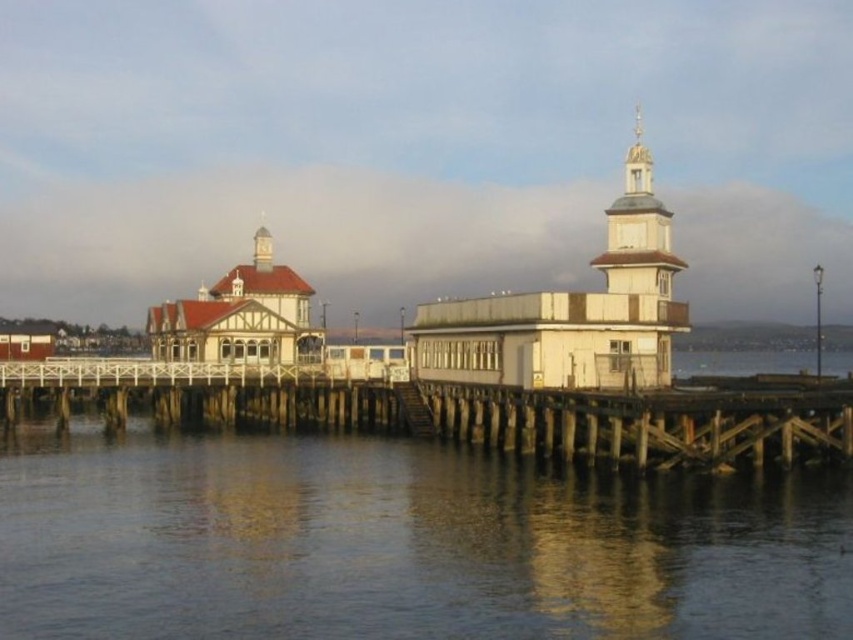
You are standing on the wooden pier and want to take a photo of both the wooden at lower center and the white wooden tower at center. Which one should you point your camera towards first if you want to capture them in the order they appear from left to right?

You should first point your camera towards the wooden at lower center since it is positioned to the left of the white wooden tower at center.

You are a delivery drone that needs to land on the white wooden tower at center. The landing pad is on the tower, and your current position is above the transparent water at lower center. What is the horizontal distance you need to cover to reach the landing pad?

The horizontal distance between the transparent water at lower center and the white wooden tower at center is 20.08 meters, so you need to cover 20.08 meters horizontally to reach the landing pad.